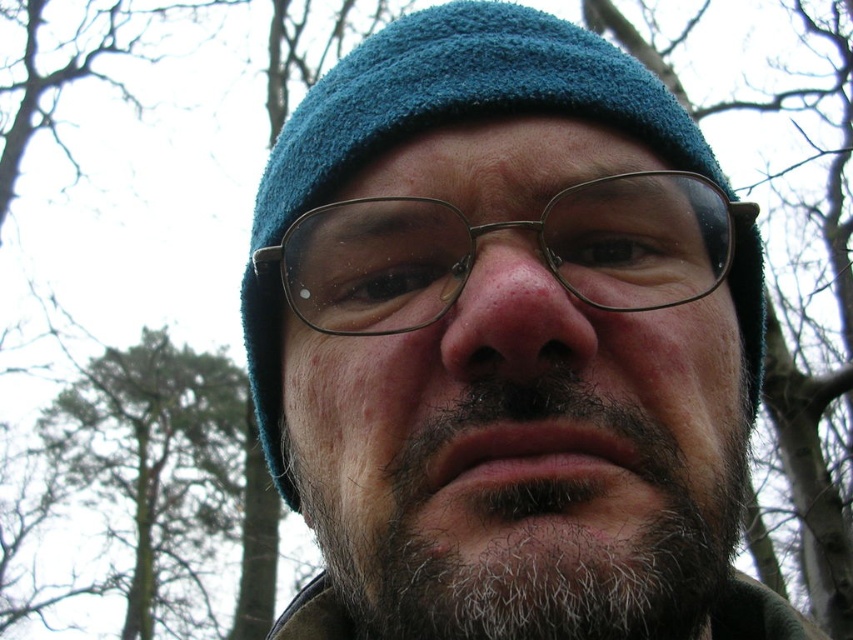
Is point (294, 237) closer to viewer compared to point (160, 369)?

Yes, it is.

Which is in front, point (726, 200) or point (96, 410)?

Point (726, 200)

At what (x,y) coordinates should I click in order to perform the action: click on metallic brown glasses at center. Please return your answer as a coordinate pair (x, y). The height and width of the screenshot is (640, 853). Looking at the image, I should click on (500, 228).

Is gray/woolly beard at center in front of green leafy tree at left?

Yes, gray/woolly beard at center is closer to the viewer.

Can you confirm if gray/woolly beard at center is bigger than green leafy tree at left?

No, gray/woolly beard at center is not bigger than green leafy tree at left.

What do you see at coordinates (535, 525) in the screenshot?
I see `gray/woolly beard at center` at bounding box center [535, 525].

Identify the location of gray/woolly beard at center. This screenshot has height=640, width=853. (535, 525).

The image size is (853, 640). Describe the element at coordinates (535, 525) in the screenshot. I see `gray/woolly beard at center` at that location.

Who is more distant from viewer, (314, 490) or (451, 225)?

The point (314, 490) is more distant.

Is point (343, 561) positioned after point (660, 266)?

Yes, point (343, 561) is behind point (660, 266).

Where is `gray/woolly beard at center`? gray/woolly beard at center is located at coordinates (535, 525).